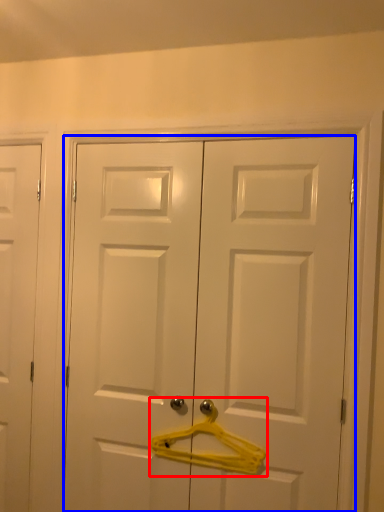
Question: Which object is further to the camera taking this photo, hanger (highlighted by a red box) or door (highlighted by a blue box)?

Choices:
 (A) hanger
 (B) door

Answer: (A)